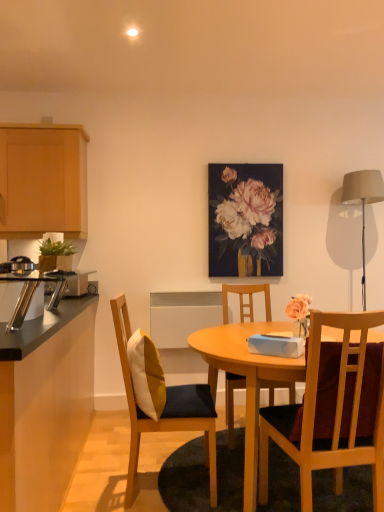
Describe the element at coordinates (363, 203) in the screenshot. I see `matte gray lampshade at right` at that location.

Image resolution: width=384 pixels, height=512 pixels. What do you see at coordinates (43, 180) in the screenshot?
I see `light wood cabinet at upper left, the 1th cabinetry from the top` at bounding box center [43, 180].

The width and height of the screenshot is (384, 512). What do you see at coordinates (33, 294) in the screenshot? I see `metallic silver toaster at left, the 2th appliance viewed from the back` at bounding box center [33, 294].

The image size is (384, 512). Describe the element at coordinates (248, 300) in the screenshot. I see `wooden chair at center, which is counted as the 2th chair, starting from the left` at that location.

Locate an element on the screen. This screenshot has width=384, height=512. wooden chair at center, the 1th chair in the right-to-left sequence is located at coordinates (330, 410).

Who is bigger, satin silver toaster at left, positioned as the 2th appliance in right-to-left order, or green leafy plant at left?

With larger size is satin silver toaster at left, positioned as the 2th appliance in right-to-left order.

The image size is (384, 512). Find the location of `the 2nd appliance counting from the left side of the green leafy plant at left`. the 2nd appliance counting from the left side of the green leafy plant at left is located at coordinates (80, 285).

Is satin silver toaster at left, positioned as the 2th appliance in right-to-left order, to the left or to the right of green leafy plant at left in the image?

From the image, it's evident that satin silver toaster at left, positioned as the 2th appliance in right-to-left order, is to the left of green leafy plant at left.

Is satin silver toaster at left, positioned as the 2th appliance in right-to-left order, looking in the opposite direction of green leafy plant at left?

No, satin silver toaster at left, positioned as the 2th appliance in right-to-left order,'s orientation is not away from green leafy plant at left.

Is white/yellow fabric pillow at center-left inside the boundaries of wooden chair at center, the 3th chair from the left, or outside?

white/yellow fabric pillow at center-left is outside wooden chair at center, the 3th chair from the left.

Locate an element on the screen. This screenshot has height=512, width=384. pillow that is above the wooden chair at center, the 1th chair in the right-to-left sequence (from the image's perspective) is located at coordinates (146, 375).

Considering their positions, is white/yellow fabric pillow at center-left located in front of or behind wooden chair at center, placed as the first chair when sorted from front to back?

white/yellow fabric pillow at center-left is positioned farther from the viewer than wooden chair at center, placed as the first chair when sorted from front to back.

Looking at their sizes, would you say white/yellow fabric pillow at center-left is wider or thinner than wooden chair at center, placed as the first chair when sorted from front to back?

In the image, white/yellow fabric pillow at center-left appears to be more narrow than wooden chair at center, placed as the first chair when sorted from front to back.

From a real-world perspective, which object stands above the other?

matte gray lampshade at right.

Considering the relative sizes of matte gray lampshade at right and satin silver toaster at left, which is counted as the 2th appliance, starting from the front, in the image provided, is matte gray lampshade at right shorter than satin silver toaster at left, which is counted as the 2th appliance, starting from the front,?

No, matte gray lampshade at right is not shorter than satin silver toaster at left, which is counted as the 2th appliance, starting from the front.

Which of these two, matte gray lampshade at right or satin silver toaster at left, arranged as the first appliance when viewed from the back, is thinner?

satin silver toaster at left, arranged as the first appliance when viewed from the back.

In the scene shown: From the image's perspective, relative to satin silver toaster at left, arranged as the first appliance when viewed from the back, is matte gray lampshade at right above or below?

matte gray lampshade at right is above satin silver toaster at left, arranged as the first appliance when viewed from the back.

Is matte gray lampshade at right completely or partially inside metallic silver toaster at left, the first appliance in the front-to-back sequence?

No.

Considering the positions of points (18, 298) and (346, 204), is point (18, 298) farther from camera compared to point (346, 204)?

No.

Which is more to the right, metallic silver toaster at left, the 2th appliance viewed from the back, or matte gray lampshade at right?

Positioned to the right is matte gray lampshade at right.

How distant is metallic silver toaster at left, positioned as the second appliance in left-to-right order, from matte gray lampshade at right?

7.77 feet.

Based on their sizes in the image, would you say light wood cabinet at upper left, the second cabinetry positioned from the bottom, is bigger or smaller than wooden chair with cushion at center, the second chair from the front?

Considering their sizes, light wood cabinet at upper left, the second cabinetry positioned from the bottom, takes up more space than wooden chair with cushion at center, the second chair from the front.

Could wooden chair with cushion at center, acting as the 3th chair starting from the right, be considered to be inside light wood cabinet at upper left, the second cabinetry positioned from the bottom?

Actually, wooden chair with cushion at center, acting as the 3th chair starting from the right, is outside light wood cabinet at upper left, the second cabinetry positioned from the bottom.

Which is more to the left, light wood cabinet at upper left, the 1th cabinetry from the top, or wooden chair with cushion at center, the second chair from the front?

Positioned to the left is light wood cabinet at upper left, the 1th cabinetry from the top.

Which is in front, point (1, 177) or point (129, 501)?

The point (129, 501) is closer.

Looking at this image, from the image's perspective, which is below, white/yellow fabric pillow at center-left or light wood cabinet at upper left, the 1th cabinetry from the top?

From the image's view, white/yellow fabric pillow at center-left is below.

From a real-world perspective, which object rests below the other?

white/yellow fabric pillow at center-left is physically lower.

Does white/yellow fabric pillow at center-left contain light wood cabinet at upper left, the second cabinetry positioned from the bottom?

No, light wood cabinet at upper left, the second cabinetry positioned from the bottom, is not a part of white/yellow fabric pillow at center-left.

How far apart are white/yellow fabric pillow at center-left and light wood cabinet at upper left, the 1th cabinetry from the top?

4.75 feet.

Which object is thinner, satin silver toaster at left, arranged as the first appliance when viewed from the back, or metallic silver toaster at left, the 2th appliance viewed from the back?

metallic silver toaster at left, the 2th appliance viewed from the back, is thinner.

From a real-world perspective, which object stands above the other?

From a 3D spatial view, metallic silver toaster at left, the 2th appliance viewed from the back, is above.

Considering their positions, is satin silver toaster at left, positioned as the 2th appliance in right-to-left order, located in front of or behind metallic silver toaster at left, acting as the 1th appliance starting from the right?

Visually, satin silver toaster at left, positioned as the 2th appliance in right-to-left order, is located behind metallic silver toaster at left, acting as the 1th appliance starting from the right.

Between point (45, 292) and point (55, 309), which one is positioned in front?

The point (45, 292) is closer to the camera.

You are a GUI agent. You are given a task and a screenshot of the screen. Output one action in this format:
    pyautogui.click(x=<x>, y=<y>)
    Task: Click on the houseplant on the right of the satin silver toaster at left, which is counted as the 2th appliance, starting from the front
    The height and width of the screenshot is (512, 384).
    Given the screenshot: What is the action you would take?
    pyautogui.click(x=56, y=255)

Where is `pillow above the wooden chair at center, the 3th chair from the left (from the image's perspective)`? Image resolution: width=384 pixels, height=512 pixels. pillow above the wooden chair at center, the 3th chair from the left (from the image's perspective) is located at coordinates (146, 375).

When comparing their distances from floral bouquet at center, does wooden chair at center, the 1th chair in the right-to-left sequence, or green leafy plant at left seem closer?

The object closer to floral bouquet at center is green leafy plant at left.

Estimate the real-world distances between objects in this image. Which object is further from green leafy plant at left, matte gray lampshade at right or satin silver toaster at left, positioned as the 2th appliance in right-to-left order?

matte gray lampshade at right lies further to green leafy plant at left than the other object.

Looking at the image, which one is located further to metallic silver toaster at left, acting as the 1th appliance starting from the right, floral bouquet at center or satin silver toaster at left, positioned as the 2th appliance in right-to-left order?

floral bouquet at center lies further to metallic silver toaster at left, acting as the 1th appliance starting from the right, than the other object.

From the image, which object appears to be farther from matte gray lampshade at right, green leafy plant at left or wooden chair with cushion at center, acting as the 3th chair starting from the right?

The object further to matte gray lampshade at right is green leafy plant at left.

Looking at the image, which one is located closer to wooden chair at center, which is counted as the 3th chair, starting from the back, green leafy plant at left or matte gray lampshade at right?

Among the two, green leafy plant at left is located nearer to wooden chair at center, which is counted as the 3th chair, starting from the back.

Estimate the real-world distances between objects in this image. Which object is further from floral bouquet at center, light wood cabinet at upper left, the second cabinetry positioned from the bottom, or satin silver toaster at left, arranged as the first appliance when viewed from the back?

Based on the image, light wood cabinet at upper left, the second cabinetry positioned from the bottom, appears to be further to floral bouquet at center.

From the image, which object appears to be nearer to matte gray lampshade at right, white/yellow fabric pillow at center-left or metallic silver toaster at left, positioned as the second appliance in left-to-right order?

Based on the image, white/yellow fabric pillow at center-left appears to be nearer to matte gray lampshade at right.

From the picture: Estimate the real-world distances between objects in this image. Which object is closer to white/yellow fabric pillow at center-left, floral bouquet at center or light wood cabinet at upper left, the 1th cabinetry from the top?

light wood cabinet at upper left, the 1th cabinetry from the top.

Locate an element on the screen. This screenshot has width=384, height=512. cabinetry between black laminate countertop at left, the 2th cabinetry from the top, and floral bouquet at center from front to back is located at coordinates (43, 180).

This screenshot has height=512, width=384. I want to click on lamp between wooden chair at center, placed as the first chair when sorted from front to back, and floral bouquet at center in the front-back direction, so click(x=363, y=203).

Find the location of a particular element. This screenshot has width=384, height=512. pillow between green leafy plant at left and wooden chair at center, which is counted as the 3th chair, starting from the back is located at coordinates (146, 375).

Find the location of a particular element. pillow between black laminate countertop at left, the 1th cabinetry ordered from the bottom, and green leafy plant at left in the front-back direction is located at coordinates (146, 375).